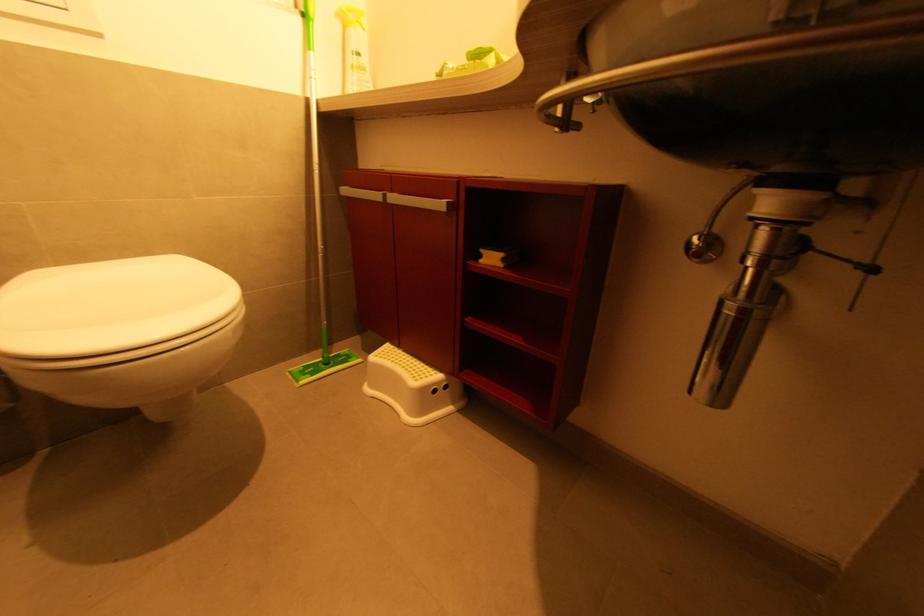
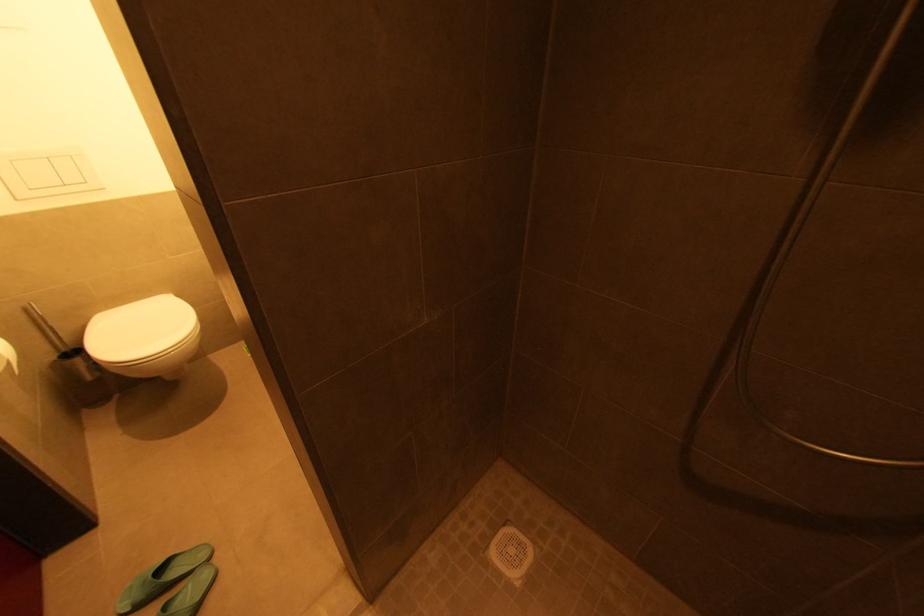
Which direction would the cameraman need to move to produce the second image?

The cameraman moved toward right, backward.